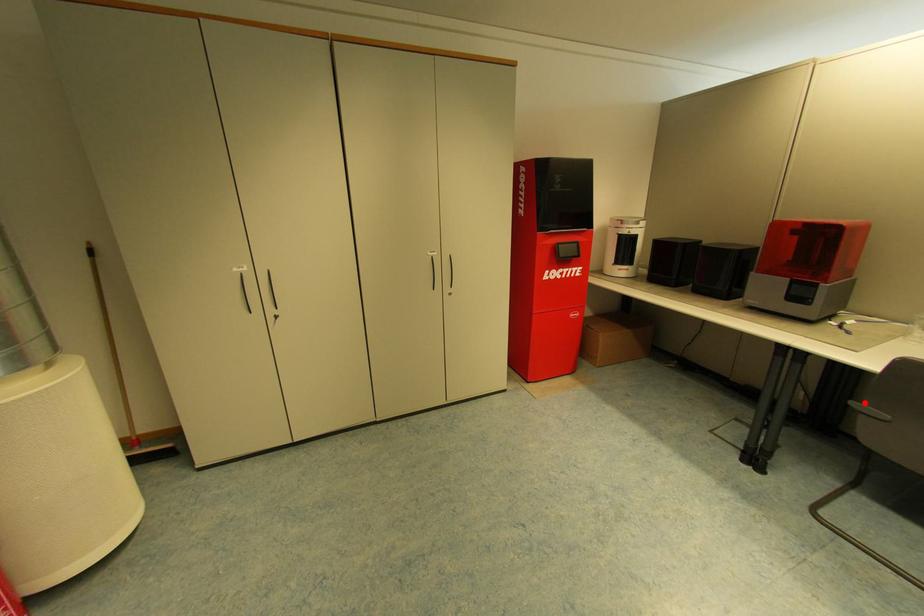
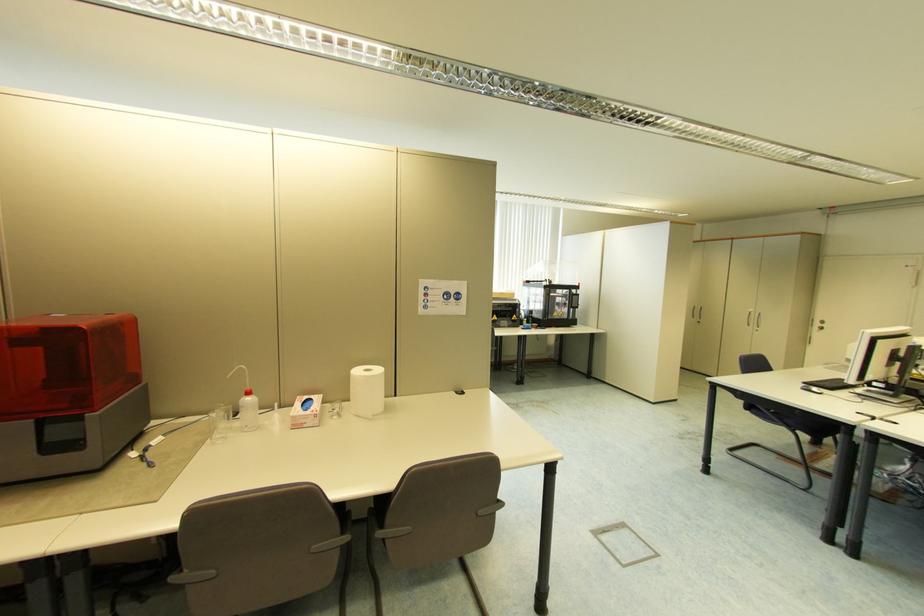
Question: I am providing you with two images of the same scene from different viewpoints. A red point is shown in image1. For the corresponding object point in image2, is it positioned nearer or farther from the camera?

Choices:
 (A) Nearer
 (B) Farther

Answer: (A)